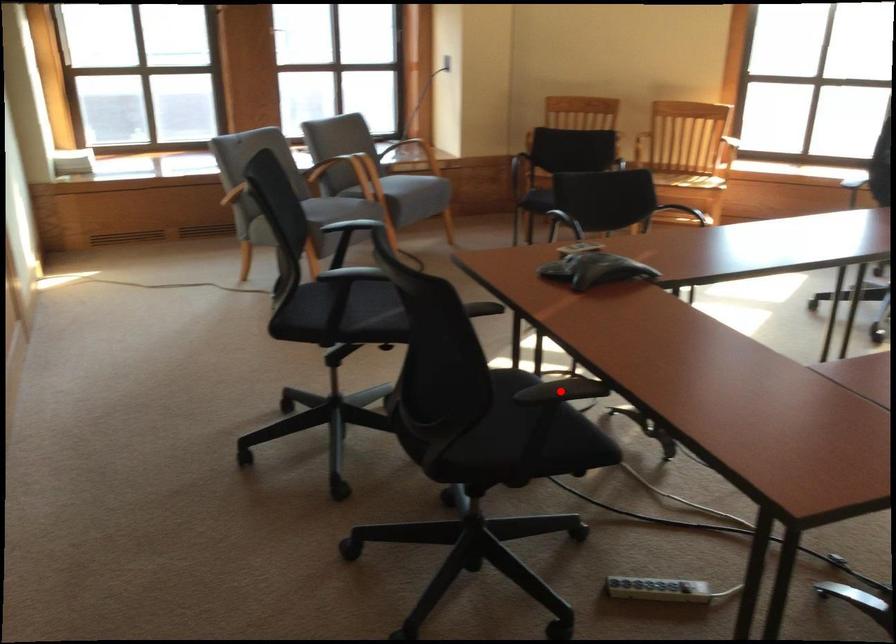
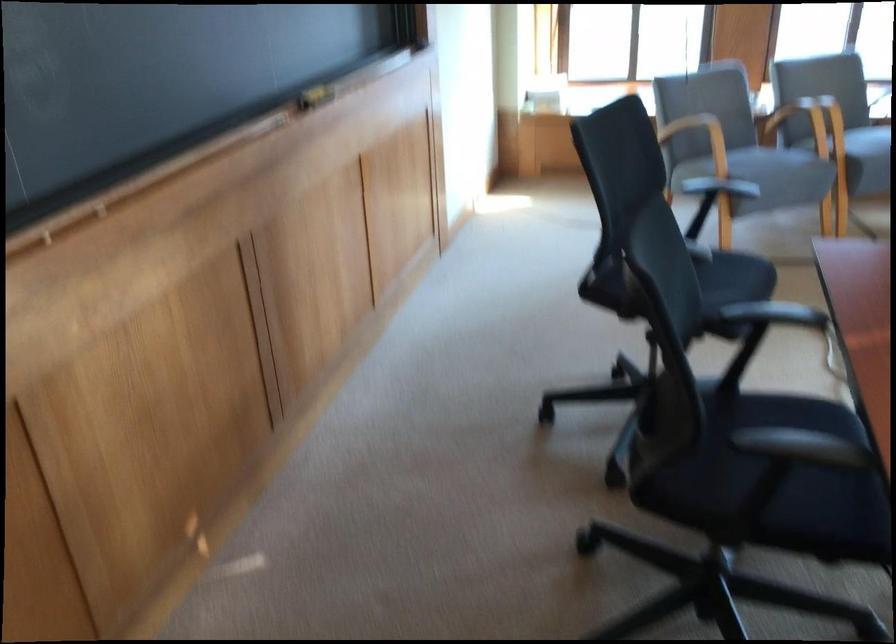
Question: I am providing you with two images of the same scene from different viewpoints. A red point is marked on the first image. Can you still see the location of the red point in image 2?

Choices:
 (A) Yes
 (B) No

Answer: (B)